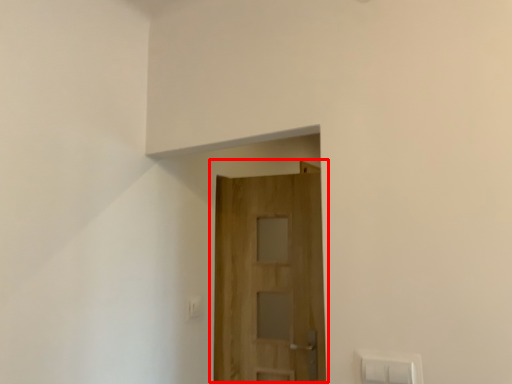
Question: Where is door (annotated by the red box) located in relation to light switch in the image?

Choices:
 (A) left
 (B) right

Answer: (B)